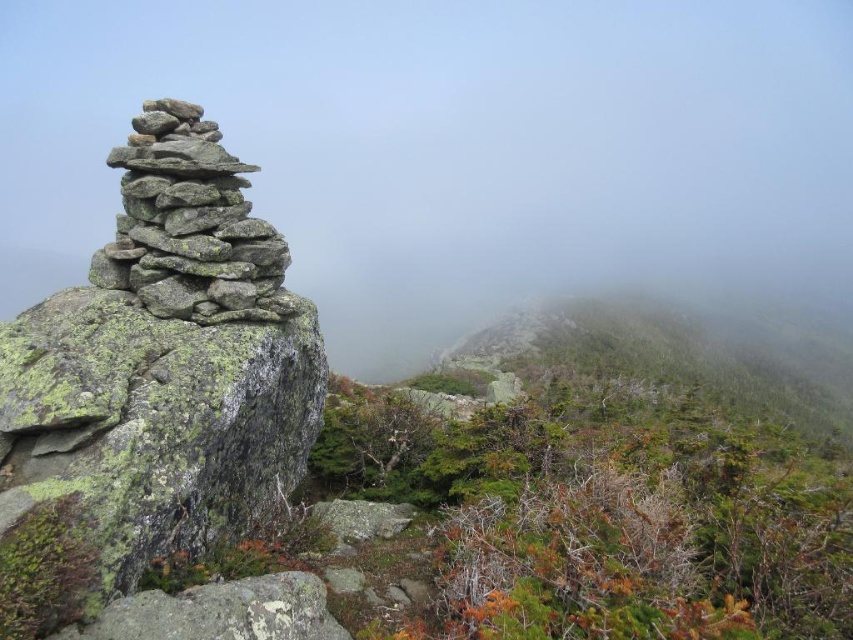
You are a hiker trying to navigate through the misty mountain terrain. You notice two gray stacks on your left side. The first is labeled as the gray rough stone stack at left, and the second is the gray rock stack at left. Which one is closer to your current position?

Both the gray rough stone stack at left and the gray rock stack at left are located on your left side and are 12.42 feet apart from each other. Since they are both on the left, their distance from you depends on their position along the left side. However, without additional information about their placement relative to each other along the left axis, I cannot determine which is closer.

You are a hiker trying to navigate through the misty mountains. You see two gray stacks of stones on your left side. One is labeled as the gray rough stone stack at left and the other is the gray rock stack at left. Which of these two stacks is taller?

The gray rock stack at left is taller than the gray rough stone stack at left.